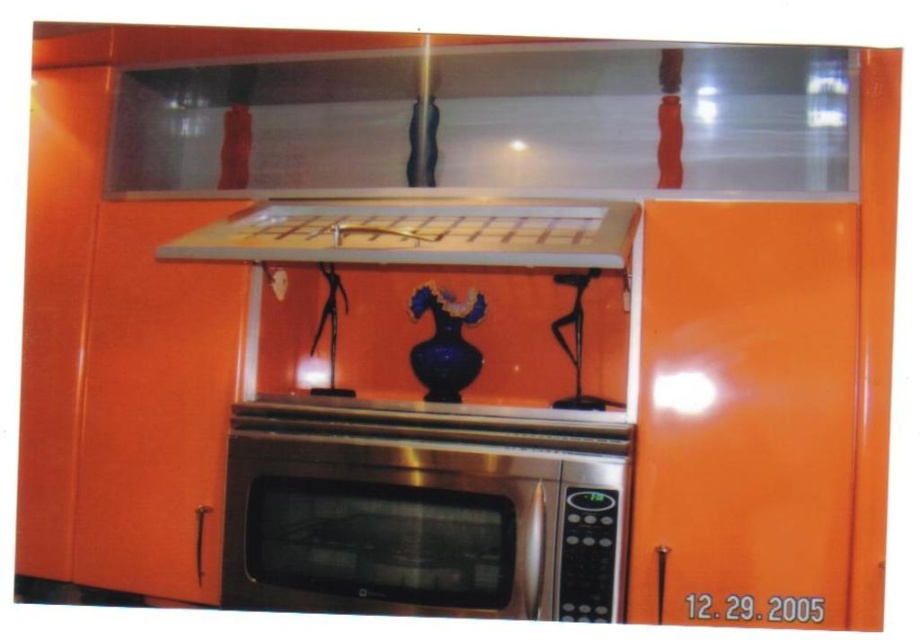
Between matte white exhaust hood at upper center and blue glass vase at center, which one has less height?

With less height is matte white exhaust hood at upper center.

Can you confirm if matte white exhaust hood at upper center is bigger than blue glass vase at center?

Indeed, matte white exhaust hood at upper center has a larger size compared to blue glass vase at center.

Where is `matte white exhaust hood at upper center`? This screenshot has height=640, width=920. matte white exhaust hood at upper center is located at coordinates (420, 234).

Looking at this image, who is more distant from viewer, (600, 572) or (424, 305)?

The point (424, 305) is more distant.

Is point (330, 556) positioned behind point (426, 376)?

No, (330, 556) is in front of (426, 376).

Describe the element at coordinates (423, 509) in the screenshot. The image size is (920, 640). I see `stainless steel microwave at center` at that location.

This screenshot has width=920, height=640. Identify the location of stainless steel microwave at center. (423, 509).

Is point (547, 474) more distant than point (297, 202)?

No, (547, 474) is closer to viewer.

Is stainless steel microwave at center above matte white exhaust hood at upper center?

Actually, stainless steel microwave at center is below matte white exhaust hood at upper center.

This screenshot has width=920, height=640. In order to click on stainless steel microwave at center in this screenshot , I will do click(423, 509).